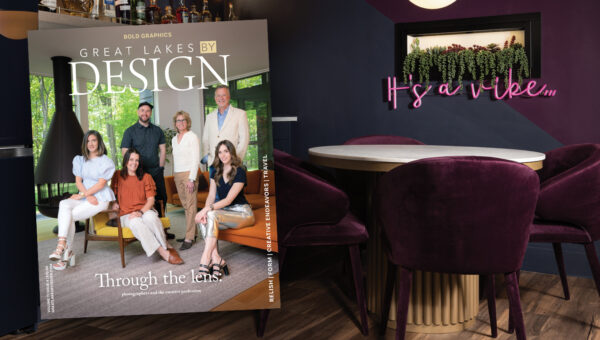
What are the coordinates of `floor` in the screenshot? It's located at (565, 326).